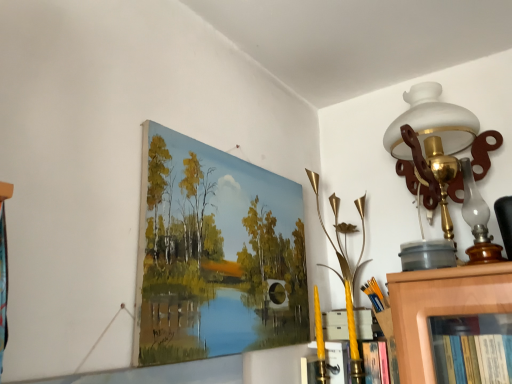
Image resolution: width=512 pixels, height=384 pixels. What do you see at coordinates (215, 254) in the screenshot? I see `matte canvas painting at upper left` at bounding box center [215, 254].

Where is `matte canvas painting at upper left`? matte canvas painting at upper left is located at coordinates (215, 254).

What is the approximate height of matte canvas painting at upper left?

It is 20.34 inches.

Where is `matte canvas painting at upper left`? The height and width of the screenshot is (384, 512). matte canvas painting at upper left is located at coordinates (215, 254).